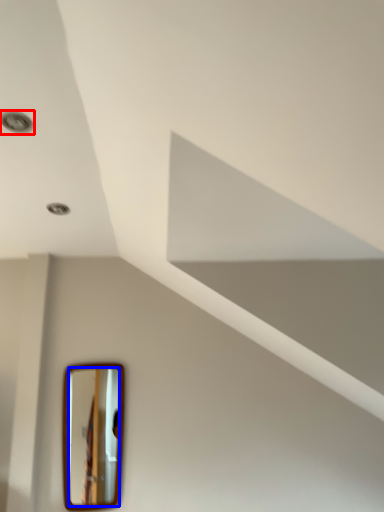
Question: Which of the following is the farthest to the observer, droplight (highlighted by a red box) or mirror (highlighted by a blue box)?

Choices:
 (A) droplight
 (B) mirror

Answer: (B)